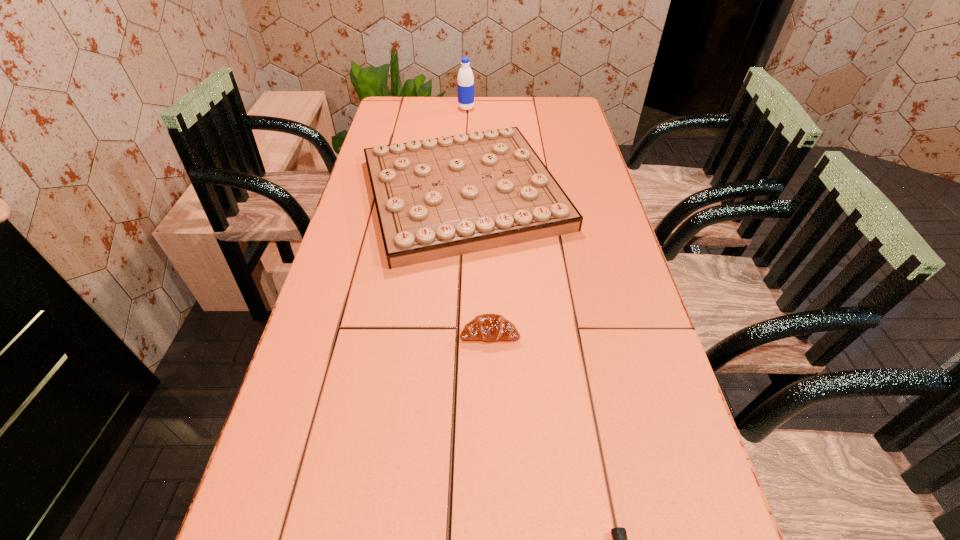
You are a GUI agent. You are given a task and a screenshot of the screen. Output one action in this format:
    pyautogui.click(x=<x>, y=<y>)
    Task: Click on the object situated at the left edge
    This screenshot has height=540, width=960.
    Given the screenshot: What is the action you would take?
    pyautogui.click(x=436, y=198)

Identify the location of object located in the right edge section of the desktop. This screenshot has height=540, width=960. (436, 198).

Image resolution: width=960 pixels, height=540 pixels. I want to click on blank space at the far edge, so click(x=441, y=107).

This screenshot has width=960, height=540. In the image, there is a desktop. Identify the location of free region at the left edge. click(361, 224).

At what (x,y) coordinates should I click in order to perform the action: click on vacant position at the right edge of the desktop. Please return your answer as a coordinate pair (x, y). The width and height of the screenshot is (960, 540). Looking at the image, I should click on (671, 533).

Find the location of `vacant space at the far left corner of the desktop`. vacant space at the far left corner of the desktop is located at coordinates (386, 116).

This screenshot has height=540, width=960. I want to click on free point at the far right corner, so click(x=572, y=100).

Where is `free space between the crescent roll and the third shortest object`? The image size is (960, 540). free space between the crescent roll and the third shortest object is located at coordinates (476, 263).

Identify the location of the closest object to the shortest object. (489, 327).

Identify which object is the nearest to the farthest object. Please provide its 2D coordinates. Your answer should be formatted as a tuple, i.e. [(x, y)], where the tuple contains the x and y coordinates of a point satisfying the conditions above.

[(436, 198)]